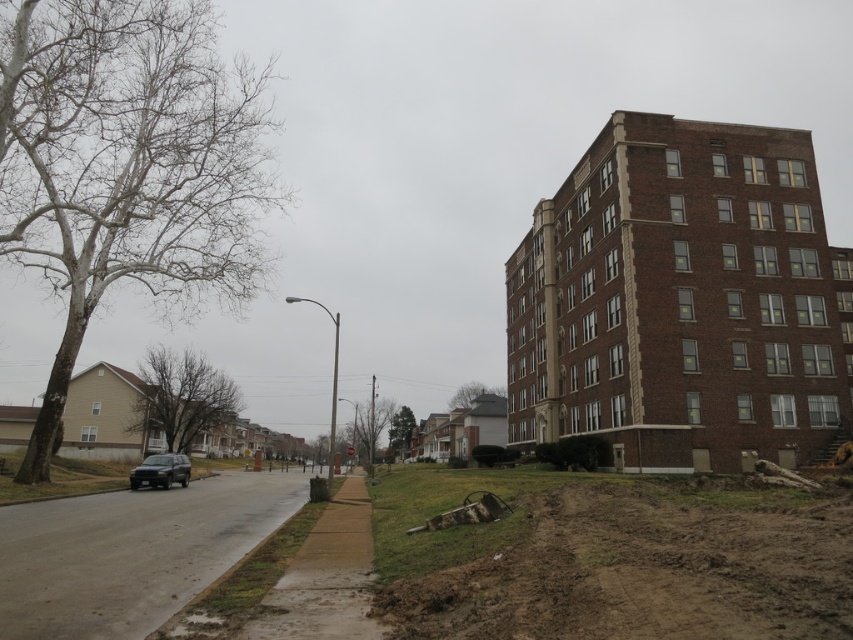
Question: Does gray asphalt road at lower left have a lesser width compared to green leafy tree at center?

Choices:
 (A) no
 (B) yes

Answer: (A)

Question: Which of the following is the closest to the observer?

Choices:
 (A) green matte tree at center
 (B) gray asphalt road at lower left

Answer: (B)

Question: Can you confirm if brown leafless tree at center-left is positioned to the right of brown leafless tree at center?

Choices:
 (A) no
 (B) yes

Answer: (A)

Question: Which point appears farthest from the camera in this image?

Choices:
 (A) (172, 483)
 (B) (471, 394)

Answer: (B)

Question: Does green leafy tree at center have a larger size compared to green matte tree at center?

Choices:
 (A) no
 (B) yes

Answer: (A)

Question: Which point appears closest to the camera in this image?

Choices:
 (A) (74, 3)
 (B) (27, 595)
 (C) (412, 417)

Answer: (B)